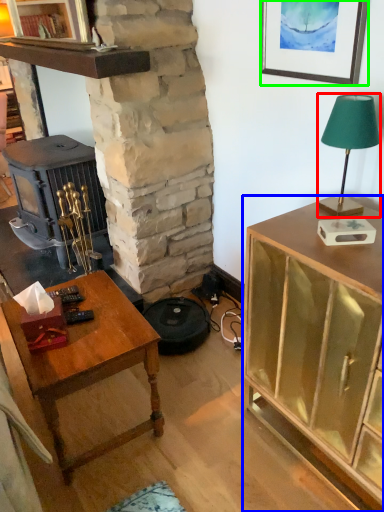
Question: Estimate the real-world distances between objects in this image. Which object is farther from lamp (highlighted by a red box), cabinetry (highlighted by a blue box) or picture frame (highlighted by a green box)?

Choices:
 (A) cabinetry
 (B) picture frame

Answer: (A)